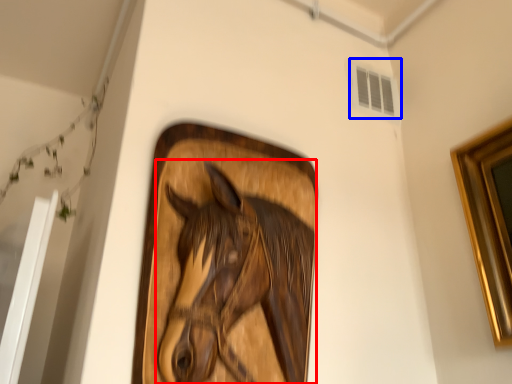
Question: Which object is further to the camera taking this photo, horse (highlighted by a red box) or window (highlighted by a blue box)?

Choices:
 (A) horse
 (B) window

Answer: (B)